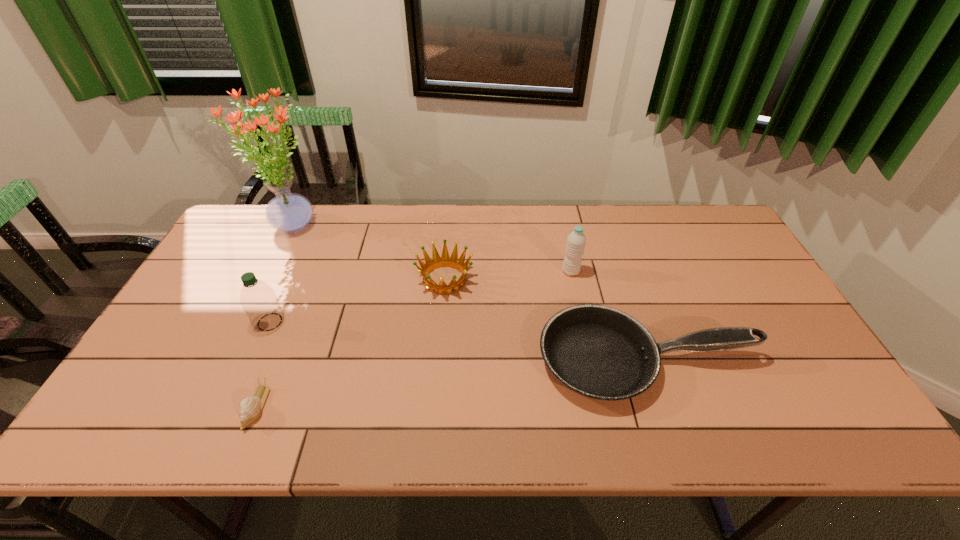
Locate an element on the screen. the tallest object is located at coordinates (290, 212).

The image size is (960, 540). Find the location of `the farthest object`. the farthest object is located at coordinates (290, 212).

Where is `the nearer water bottle`? The height and width of the screenshot is (540, 960). the nearer water bottle is located at coordinates (259, 301).

You are a GUI agent. You are given a task and a screenshot of the screen. Output one action in this format:
    pyautogui.click(x=<x>, y=<y>)
    Task: Click on the right water bottle
    Image resolution: width=960 pixels, height=540 pixels.
    Given the screenshot: What is the action you would take?
    pyautogui.click(x=576, y=240)

At what (x,y) coordinates should I click in order to perform the action: click on crown. Please return your answer as a coordinate pair (x, y). Image resolution: width=960 pixels, height=540 pixels. Looking at the image, I should click on (445, 260).

Where is `frying pan`? The width and height of the screenshot is (960, 540). frying pan is located at coordinates (599, 352).

This screenshot has width=960, height=540. Find the location of `escargot`. escargot is located at coordinates (249, 409).

Where is `free space located 0.170m on the right of the flower arrangement`? The width and height of the screenshot is (960, 540). free space located 0.170m on the right of the flower arrangement is located at coordinates (373, 226).

Locate an element on the screen. This screenshot has width=960, height=540. vacant space positioned 0.200m on the left of the left water bottle is located at coordinates (180, 322).

You are a GUI agent. You are given a task and a screenshot of the screen. Output one action in this format:
    pyautogui.click(x=<x>, y=<y>)
    Task: Click on the free point located 0.220m on the right of the right water bottle
    This screenshot has width=960, height=540.
    Given the screenshot: What is the action you would take?
    pyautogui.click(x=652, y=272)